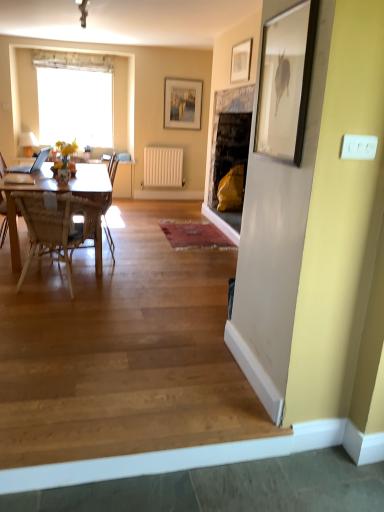
Question: Considering the relative positions of wooden at lower left and matte gold picture frame at upper center, which is counted as the 1th picture frame, starting from the front, in the image provided, is wooden at lower left in front of matte gold picture frame at upper center, which is counted as the 1th picture frame, starting from the front,?

Choices:
 (A) yes
 (B) no

Answer: (A)

Question: Can you confirm if wooden at lower left is positioned to the left of matte gold picture frame at upper center, placed as the second picture frame when sorted from back to front?

Choices:
 (A) yes
 (B) no

Answer: (A)

Question: Is wooden at lower left not within matte gold picture frame at upper center, which is counted as the 1th picture frame, starting from the front?

Choices:
 (A) yes
 (B) no

Answer: (A)

Question: Can you confirm if wooden at lower left is thinner than matte gold picture frame at upper center, placed as the second picture frame when sorted from left to right?

Choices:
 (A) yes
 (B) no

Answer: (B)

Question: Are wooden at lower left and matte gold picture frame at upper center, placed as the second picture frame when sorted from back to front, beside each other?

Choices:
 (A) yes
 (B) no

Answer: (B)

Question: From a real-world perspective, does wooden at lower left sit lower than matte gold picture frame at upper center, which is counted as the 1th picture frame, starting from the front?

Choices:
 (A) no
 (B) yes

Answer: (B)

Question: From the image's perspective, is white sheer curtain at upper left under wooden chair at left, which appears as the 1th chair when viewed from the back?

Choices:
 (A) no
 (B) yes

Answer: (A)

Question: Could you tell me if white sheer curtain at upper left is turned towards wooden chair at left, which is the second chair in front-to-back order?

Choices:
 (A) yes
 (B) no

Answer: (A)

Question: Is white sheer curtain at upper left bigger than wooden chair at left, which is the second chair in front-to-back order?

Choices:
 (A) no
 (B) yes

Answer: (B)

Question: Is white sheer curtain at upper left in contact with wooden chair at left, which appears as the 1th chair when viewed from the back?

Choices:
 (A) no
 (B) yes

Answer: (A)

Question: From the image's perspective, would you say white sheer curtain at upper left is positioned over wooden chair at left, which appears as the 1th chair when viewed from the back?

Choices:
 (A) yes
 (B) no

Answer: (A)

Question: Is wooden chair at left, which appears as the 1th chair when viewed from the back, located within white sheer curtain at upper left?

Choices:
 (A) yes
 (B) no

Answer: (B)

Question: Does matte glass vase at center have a larger size compared to woven wood chair at left, positioned as the 2th chair in back-to-front order?

Choices:
 (A) yes
 (B) no

Answer: (B)